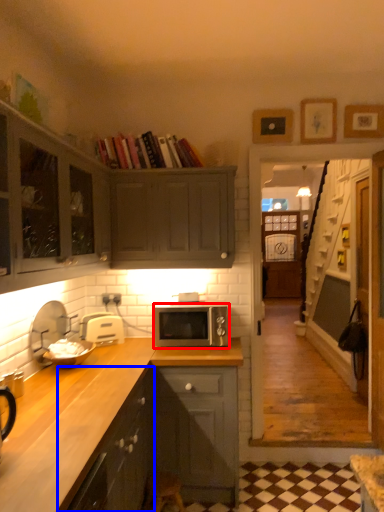
Question: Which of the following is the farthest to the observer, microwave oven (highlighted by a red box) or cabinetry (highlighted by a blue box)?

Choices:
 (A) microwave oven
 (B) cabinetry

Answer: (A)